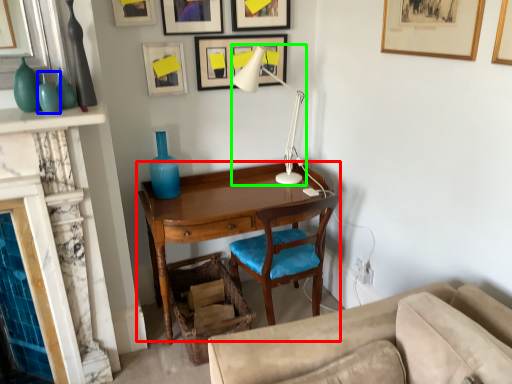
Question: Which is farther away from desk (highlighted by a red box)? turquoise (highlighted by a blue box) or table lamp (highlighted by a green box)?

Choices:
 (A) turquoise
 (B) table lamp

Answer: (A)